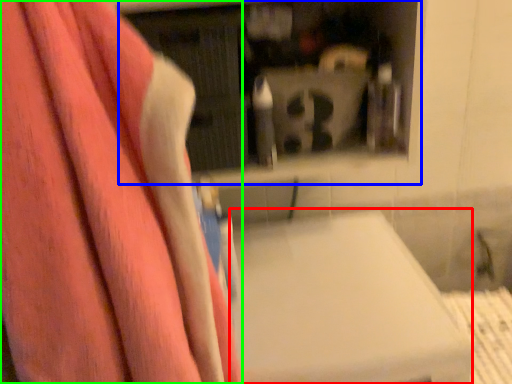
Question: Which is nearer to the lift (highlighted by a red box)? shelf (highlighted by a blue box) or towel (highlighted by a green box).

Choices:
 (A) shelf
 (B) towel

Answer: (B)